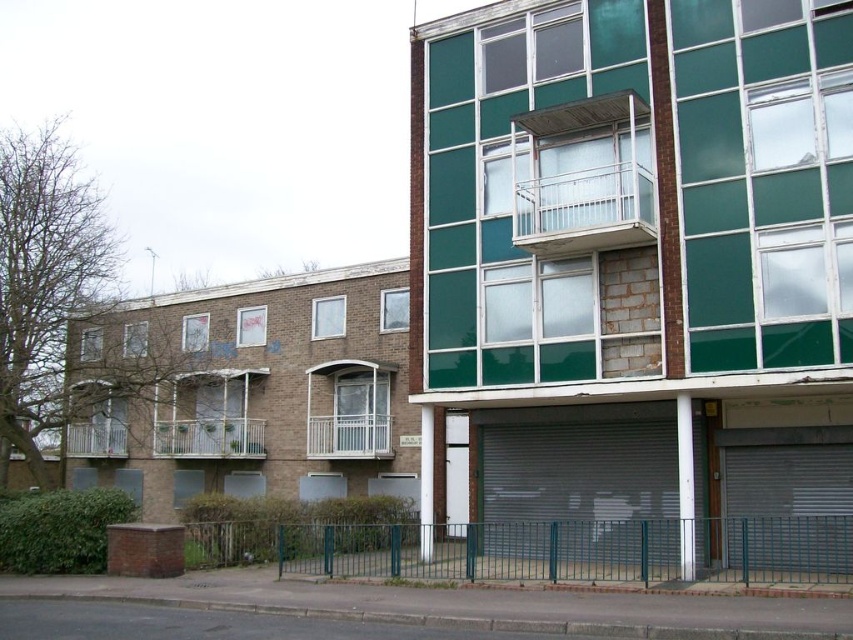
Question: Which point is closer to the camera?

Choices:
 (A) green metal fence at lower center
 (B) white textured balcony at center
 (C) white wooden balcony at center

Answer: (A)

Question: Is white metal balcony at upper center to the left of white metal balcony at lower left from the viewer's perspective?

Choices:
 (A) yes
 (B) no

Answer: (B)

Question: Which object is the closest to the white wooden balcony at center?

Choices:
 (A) white metal balcony at lower left
 (B) white textured balcony at center
 (C) white metal balcony at upper center

Answer: (A)

Question: Which point is closer to the camera taking this photo?

Choices:
 (A) (619, 241)
 (B) (171, 422)
 (C) (329, 458)

Answer: (A)

Question: Can you confirm if green metal fence at lower center is positioned below white metal balcony at lower left?

Choices:
 (A) yes
 (B) no

Answer: (A)

Question: Can you confirm if green metal fence at lower center is positioned below white textured balcony at center?

Choices:
 (A) no
 (B) yes

Answer: (B)